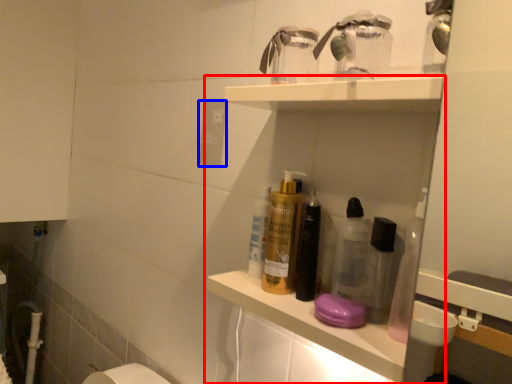
Question: Which of the following is the farthest to the observer, shelf (highlighted by a red box) or electric outlet (highlighted by a blue box)?

Choices:
 (A) shelf
 (B) electric outlet

Answer: (B)